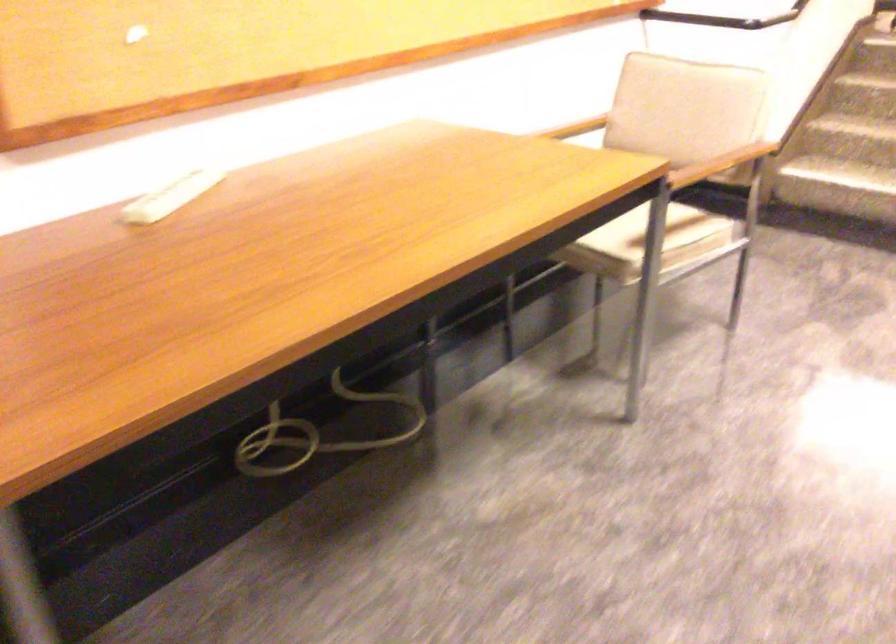
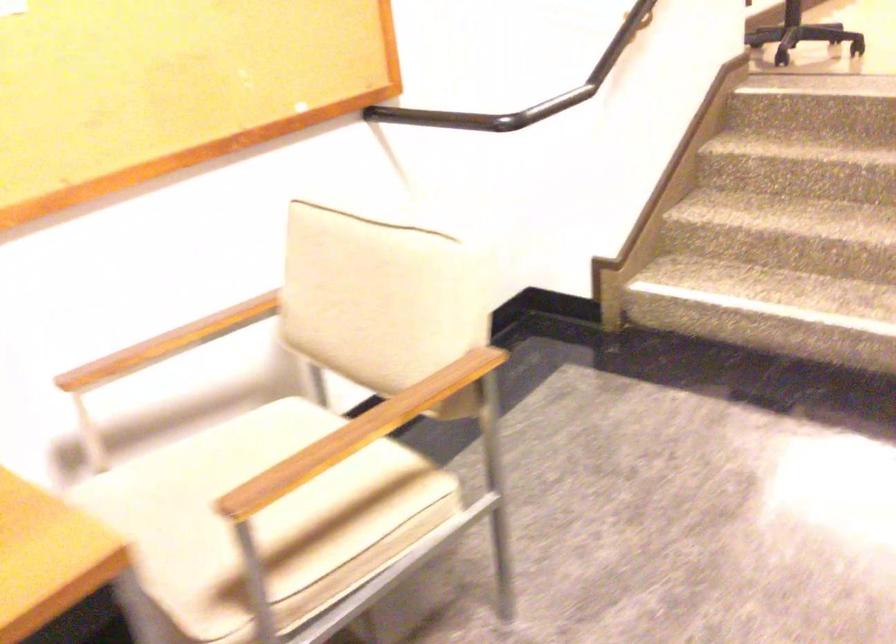
The images are taken continuously from a first-person perspective. In which direction are you moving?

The cameraman walked toward right, forward.